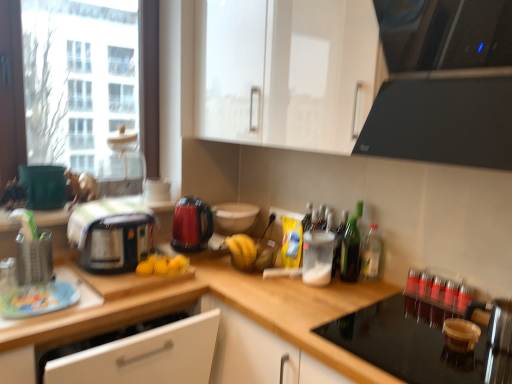
I want to click on translucent plastic container at center, the second appliance in the right-to-left sequence, so click(317, 257).

The image size is (512, 384). What do you see at coordinates (317, 257) in the screenshot?
I see `translucent plastic container at center, the second appliance in the right-to-left sequence` at bounding box center [317, 257].

Describe the element at coordinates (415, 344) in the screenshot. I see `black glass stovetop at lower right, which is the first appliance from right to left` at that location.

In order to face black glass stovetop at lower right, positioned as the fifth appliance in left-to-right order, should I rotate leftwards or rightwards?

A 22.042 degree turn to the right will do.

The width and height of the screenshot is (512, 384). What do you see at coordinates (230, 306) in the screenshot?
I see `wooden at center, placed as the 2th countertop when sorted from left to right` at bounding box center [230, 306].

Find the location of a particular element. metallic silver utensil holder at left, marked as the 4th appliance in a right-to-left arrangement is located at coordinates (34, 259).

You are a GUI agent. You are given a task and a screenshot of the screen. Output one action in this format:
    pyautogui.click(x=<x>, y=<y>)
    Task: Click on the clear glass bottle at right, acting as the second bottle starting from the right
    The width and height of the screenshot is (512, 384).
    Given the screenshot: What is the action you would take?
    pyautogui.click(x=371, y=255)

In order to click on translucent plastic container at center, the 4th appliance positioned from the left in this screenshot , I will do tap(317, 257).

From the image's perspective, which object appears higher, wooden at left, the 1th countertop from the left, or transparent glass window at upper left?

From the image's view, transparent glass window at upper left is above.

Does wooden at left, which is the 2th countertop from right to left, appear on the right side of transparent glass window at upper left?

Correct, you'll find wooden at left, which is the 2th countertop from right to left, to the right of transparent glass window at upper left.

Could you measure the distance between wooden at left, the 1th countertop from the left, and transparent glass window at upper left?

A distance of 98.86 centimeters exists between wooden at left, the 1th countertop from the left, and transparent glass window at upper left.

In the image, is wooden at left, which is the 2th countertop from right to left, positioned in front of or behind transparent glass window at upper left?

wooden at left, which is the 2th countertop from right to left, is positioned closer to the viewer than transparent glass window at upper left.

Is metallic silver utensil holder at left, marked as the 4th appliance in a right-to-left arrangement, beside clear glass bottle at right, acting as the second bottle starting from the right?

metallic silver utensil holder at left, marked as the 4th appliance in a right-to-left arrangement, is not next to clear glass bottle at right, acting as the second bottle starting from the right, and they're not touching.

Can you confirm if metallic silver utensil holder at left, marked as the 4th appliance in a right-to-left arrangement, is wider than clear glass bottle at right, acting as the second bottle starting from the right?

Correct, the width of metallic silver utensil holder at left, marked as the 4th appliance in a right-to-left arrangement, exceeds that of clear glass bottle at right, acting as the second bottle starting from the right.

Looking at this image, can clear glass bottle at right, acting as the second bottle starting from the right, be found inside metallic silver utensil holder at left, the second appliance viewed from the left?

Definitely not — clear glass bottle at right, acting as the second bottle starting from the right, is not inside metallic silver utensil holder at left, the second appliance viewed from the left.

Looking at this image, is metallic silver utensil holder at left, marked as the 4th appliance in a right-to-left arrangement, looking in the opposite direction of clear glass bottle at right, the second bottle from the left?

metallic silver utensil holder at left, marked as the 4th appliance in a right-to-left arrangement, does not have its back to clear glass bottle at right, the second bottle from the left.

Are clear glass bottle at right, acting as the second bottle starting from the right, and wooden at left, which is the 2th countertop from right to left, beside each other?

clear glass bottle at right, acting as the second bottle starting from the right, and wooden at left, which is the 2th countertop from right to left, are clearly separated.

Between clear glass bottle at right, the second bottle from the left, and wooden at left, which is the 2th countertop from right to left, which one has larger size?

wooden at left, which is the 2th countertop from right to left.

From a real-world perspective, is clear glass bottle at right, the second bottle from the left, on top of wooden at left, which is the 2th countertop from right to left?

Indeed, from a real-world perspective, clear glass bottle at right, the second bottle from the left, stands above wooden at left, which is the 2th countertop from right to left.

Is black glass cooktop at upper right not inside wooden at left, the 1th countertop from the left?

Yes, black glass cooktop at upper right is located beyond the bounds of wooden at left, the 1th countertop from the left.

Is black glass cooktop at upper right positioned far away from wooden at left, the 1th countertop from the left?

That's right, there is a large distance between black glass cooktop at upper right and wooden at left, the 1th countertop from the left.

Can you confirm if black glass stovetop at lower right, which is the first appliance from right to left, is shorter than wooden at center, acting as the first countertop starting from the right?

Yes, black glass stovetop at lower right, which is the first appliance from right to left, is shorter than wooden at center, acting as the first countertop starting from the right.

Is wooden at center, acting as the first countertop starting from the right, surrounded by black glass stovetop at lower right, which is the first appliance from right to left?

No.

Considering the sizes of objects black glass stovetop at lower right, positioned as the fifth appliance in left-to-right order, and wooden at center, placed as the 2th countertop when sorted from left to right, in the image provided, who is thinner, black glass stovetop at lower right, positioned as the fifth appliance in left-to-right order, or wooden at center, placed as the 2th countertop when sorted from left to right,?

black glass stovetop at lower right, positioned as the fifth appliance in left-to-right order.

This screenshot has width=512, height=384. Identify the location of home appliance lying in front of the white glossy bowl at center, which is counted as the 3th appliance, starting from the right. (444, 83).

Which is in front, white glossy bowl at center, the third appliance from the left, or black glass cooktop at upper right?

Positioned in front is black glass cooktop at upper right.

Are white glossy bowl at center, which is counted as the 3th appliance, starting from the right, and black glass cooktop at upper right far apart?

Yes, white glossy bowl at center, which is counted as the 3th appliance, starting from the right, and black glass cooktop at upper right are quite far apart.

From the image's perspective, is white glossy bowl at center, the third appliance from the left, above or below black glass cooktop at upper right?

Clearly, from the image's perspective, white glossy bowl at center, the third appliance from the left, is below black glass cooktop at upper right.

Is black glass cooktop at upper right smaller than wooden at center, acting as the first countertop starting from the right?

Correct, black glass cooktop at upper right occupies less space than wooden at center, acting as the first countertop starting from the right.

Is black glass cooktop at upper right outside of wooden at center, acting as the first countertop starting from the right?

Absolutely, black glass cooktop at upper right is external to wooden at center, acting as the first countertop starting from the right.

Considering the sizes of objects black glass cooktop at upper right and wooden at center, placed as the 2th countertop when sorted from left to right, in the image provided, who is thinner, black glass cooktop at upper right or wooden at center, placed as the 2th countertop when sorted from left to right,?

black glass cooktop at upper right.

Could you tell me if black glass cooktop at upper right is facing wooden at center, acting as the first countertop starting from the right?

No, black glass cooktop at upper right is not facing towards wooden at center, acting as the first countertop starting from the right.

Locate an element on the screen. This screenshot has height=384, width=512. window above the wooden at left, the 1th countertop from the left (from the image's perspective) is located at coordinates (149, 83).

From the image's perspective, count 2nd bottles downward from the metallic silver utensil holder at left, the second appliance viewed from the left, and point to it. Please provide its 2D coordinates.

[(371, 255)]

Considering their positions, is black plastic toaster at left, the second kitchen appliance in the right-to-left sequence, positioned closer to translucent plastic container at center, the 4th appliance positioned from the left, than black glass stovetop at lower right, positioned as the fifth appliance in left-to-right order?

black glass stovetop at lower right, positioned as the fifth appliance in left-to-right order, is closer to translucent plastic container at center, the 4th appliance positioned from the left.

Which object lies nearer to the anchor point white glossy bowl at center, the third appliance from the left, black glass stovetop at lower right, positioned as the fifth appliance in left-to-right order, or translucent plastic container at center, the 4th appliance positioned from the left?

translucent plastic container at center, the 4th appliance positioned from the left, is closer to white glossy bowl at center, the third appliance from the left.

When comparing their distances from white glossy cabinet at upper center, does wooden at left, which is the 2th countertop from right to left, or white glossy bowl at center, which is counted as the 3th appliance, starting from the right, seem closer?

white glossy bowl at center, which is counted as the 3th appliance, starting from the right.

Looking at the image, which one is located further to red glass bottles at right, marked as the 3th bottle in a left-to-right arrangement, black glass stovetop at lower right, which is the first appliance from right to left, or clear glass bottle at right, acting as the second bottle starting from the right?

Based on the image, clear glass bottle at right, acting as the second bottle starting from the right, appears to be further to red glass bottles at right, marked as the 3th bottle in a left-to-right arrangement.

Which object lies further to the anchor point red glass bottles at right, marked as the 3th bottle in a left-to-right arrangement, white glossy bowl at center, the third appliance from the left, or black plastic toaster at left, the second kitchen appliance in the right-to-left sequence?

black plastic toaster at left, the second kitchen appliance in the right-to-left sequence.

Based on their spatial positions, is wooden at center, placed as the 2th countertop when sorted from left to right, or wooden at left, which is the 2th countertop from right to left, closer to translucent plastic container at center, the 4th appliance positioned from the left?

wooden at center, placed as the 2th countertop when sorted from left to right, is closer to translucent plastic container at center, the 4th appliance positioned from the left.

Looking at the image, which one is located closer to black plastic toaster at left, the second kitchen appliance in the right-to-left sequence, wooden at center, acting as the first countertop starting from the right, or white glossy cabinet at upper center?

wooden at center, acting as the first countertop starting from the right, is closer to black plastic toaster at left, the second kitchen appliance in the right-to-left sequence.

Which object lies nearer to the anchor point green glass bottle at right, the third bottle when ordered from right to left, transparent glass window at upper left or white glossy bowl at center, which is counted as the 3th appliance, starting from the right?

white glossy bowl at center, which is counted as the 3th appliance, starting from the right.

The image size is (512, 384). I want to click on appliance between green matte bucket at left, the 1th appliance viewed from the left, and white glossy bowl at center, which is counted as the 3th appliance, starting from the right, so pos(34,259).

Where is `cabinetry between black plastic toaster at left, the first kitchen appliance viewed from the left, and black glass stovetop at lower right, positioned as the fifth appliance in left-to-right order, from left to right`? cabinetry between black plastic toaster at left, the first kitchen appliance viewed from the left, and black glass stovetop at lower right, positioned as the fifth appliance in left-to-right order, from left to right is located at coordinates (285, 71).

Identify the location of bottle between glossy plastic kettle at center, marked as the 1th kitchen appliance in a right-to-left arrangement, and clear glass bottle at right, the second bottle from the left. The image size is (512, 384). (351, 247).

You are a GUI agent. You are given a task and a screenshot of the screen. Output one action in this format:
    pyautogui.click(x=<x>, y=<y>)
    Task: Click on the kitchen appliance located between black plastic toaster at left, the first kitchen appliance viewed from the left, and black glass stovetop at lower right, which is the first appliance from right to left, in the left-right direction
    The height and width of the screenshot is (384, 512).
    Given the screenshot: What is the action you would take?
    pyautogui.click(x=191, y=225)